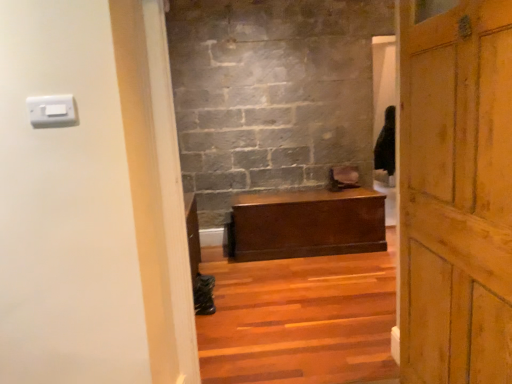
Locate an element on the screen. The height and width of the screenshot is (384, 512). vacant space situated above matte brown wooden chest at center (from a real-world perspective) is located at coordinates (337, 191).